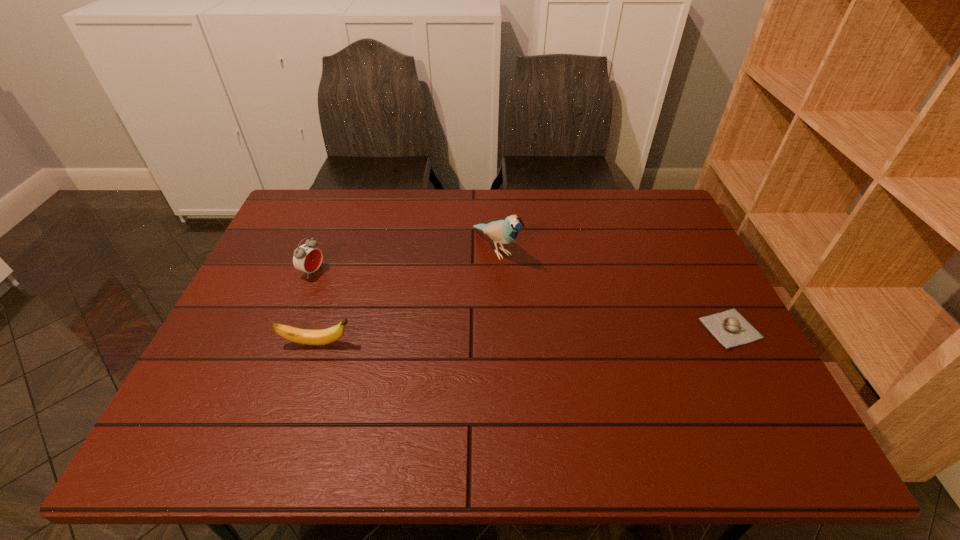
Where is `free space that is in between the bird and the third tallest object`? free space that is in between the bird and the third tallest object is located at coordinates (406, 296).

Where is `empty space between the third tallest object and the rightmost object`? The image size is (960, 540). empty space between the third tallest object and the rightmost object is located at coordinates (524, 336).

This screenshot has height=540, width=960. What are the coordinates of `vacant space that is in between the second shortest object and the garlic` in the screenshot? It's located at (524, 336).

What are the coordinates of `free space between the third object from left to right and the rightmost object` in the screenshot? It's located at (612, 288).

Where is `the second closest object to the third shortest object`? the second closest object to the third shortest object is located at coordinates (505, 231).

Where is `object that ranks as the third closest to the garlic`? The width and height of the screenshot is (960, 540). object that ranks as the third closest to the garlic is located at coordinates (307, 258).

Where is `free space that satisfies the following two spatial constraints: 1. on the front side of the shortest object; 2. on the right side of the second tallest object`? free space that satisfies the following two spatial constraints: 1. on the front side of the shortest object; 2. on the right side of the second tallest object is located at coordinates (290, 328).

Image resolution: width=960 pixels, height=540 pixels. Identify the location of vacant space that satisfies the following two spatial constraints: 1. on the back side of the third shortest object; 2. on the right side of the second object from right to left. (322, 248).

This screenshot has width=960, height=540. In order to click on free space that satisfies the following two spatial constraints: 1. on the front side of the alarm clock; 2. on the left side of the garlic in this screenshot , I will do `click(290, 328)`.

The image size is (960, 540). Identify the location of vacant position in the image that satisfies the following two spatial constraints: 1. on the front side of the tallest object; 2. on the left side of the garlic. (498, 328).